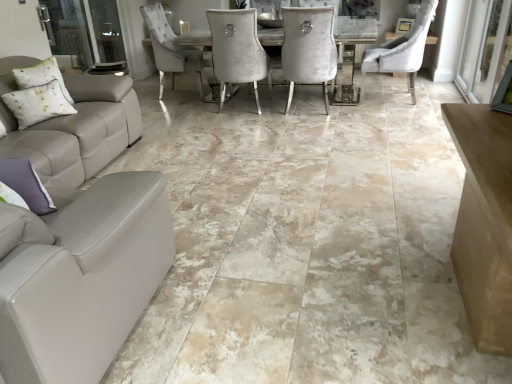
You are a GUI agent. You are given a task and a screenshot of the screen. Output one action in this format:
    pyautogui.click(x=<x>, y=<y>)
    Task: Click on the free space in front of velvet white chair at center, arranged as the second chair when viewed from the right
    Image resolution: width=512 pixels, height=384 pixels.
    Given the screenshot: What is the action you would take?
    pyautogui.click(x=318, y=125)